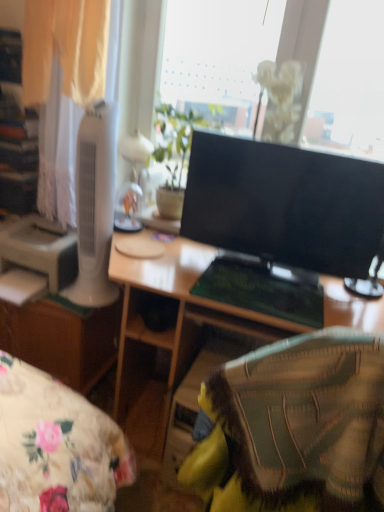
Question: Should I look upward or downward to see green leafy plant at upper center?

Choices:
 (A) down
 (B) up

Answer: (B)

Question: Does white plastic printer at left turn towards black glossy monitor at center?

Choices:
 (A) yes
 (B) no

Answer: (B)

Question: From the image's perspective, is white plastic printer at left over black glossy monitor at center?

Choices:
 (A) yes
 (B) no

Answer: (B)

Question: Is white plastic printer at left smaller than black glossy monitor at center?

Choices:
 (A) no
 (B) yes

Answer: (A)

Question: Is the depth of white plastic printer at left less than that of black glossy monitor at center?

Choices:
 (A) no
 (B) yes

Answer: (A)

Question: Are white plastic printer at left and black glossy monitor at center far apart?

Choices:
 (A) no
 (B) yes

Answer: (A)

Question: Is white plastic printer at left positioned with its back to black glossy monitor at center?

Choices:
 (A) no
 (B) yes

Answer: (A)

Question: Is black glossy monitor at center next to green leafy plant at upper center?

Choices:
 (A) yes
 (B) no

Answer: (B)

Question: Is black glossy monitor at center wider than green leafy plant at upper center?

Choices:
 (A) no
 (B) yes

Answer: (A)

Question: Considering the relative sizes of black glossy monitor at center and green leafy plant at upper center in the image provided, is black glossy monitor at center smaller than green leafy plant at upper center?

Choices:
 (A) yes
 (B) no

Answer: (B)

Question: Is black glossy monitor at center to the right of green leafy plant at upper center from the viewer's perspective?

Choices:
 (A) yes
 (B) no

Answer: (A)

Question: From the image's perspective, is black glossy monitor at center beneath green leafy plant at upper center?

Choices:
 (A) no
 (B) yes

Answer: (B)

Question: Is black glossy monitor at center positioned behind green leafy plant at upper center?

Choices:
 (A) yes
 (B) no

Answer: (B)

Question: Does black glossy monitor at center have a larger size compared to white plastic tower fan at left?

Choices:
 (A) no
 (B) yes

Answer: (B)